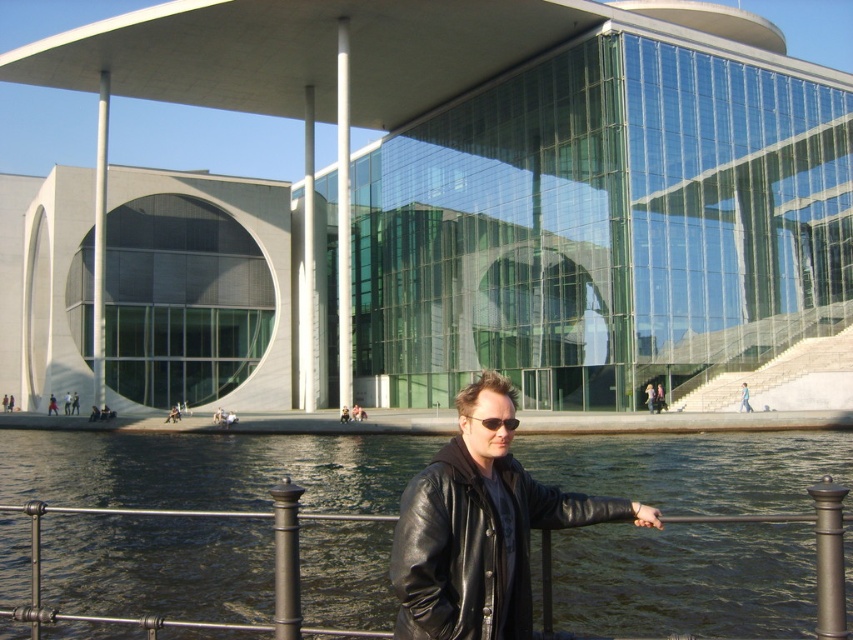
Is dark green water at lower center further to the viewer compared to black leather jacket at center?

Yes.

What do you see at coordinates (207, 468) in the screenshot? The image size is (853, 640). I see `dark green water at lower center` at bounding box center [207, 468].

Is point (163, 476) positioned after point (416, 572)?

Yes.

This screenshot has height=640, width=853. I want to click on dark green water at lower center, so click(207, 468).

In the scene shown: Which is more to the left, glassy concrete building at center or black leather jacket at center?

glassy concrete building at center is more to the left.

Is glassy concrete building at center further to the viewer compared to black leather jacket at center?

Yes, glassy concrete building at center is further from the viewer.

Between point (13, 51) and point (494, 490), which one is positioned behind?

The point (13, 51) is behind.

The height and width of the screenshot is (640, 853). In order to click on glassy concrete building at center in this screenshot , I will do point(476,202).

Is point (699, 317) farther from viewer compared to point (136, 504)?

Yes, it is.

Does glassy concrete building at center appear under dark green water at lower center?

Actually, glassy concrete building at center is above dark green water at lower center.

This screenshot has width=853, height=640. I want to click on glassy concrete building at center, so click(476, 202).

At what (x,y) coordinates should I click in order to perform the action: click on glassy concrete building at center. Please return your answer as a coordinate pair (x, y). Image resolution: width=853 pixels, height=640 pixels. Looking at the image, I should click on (476, 202).